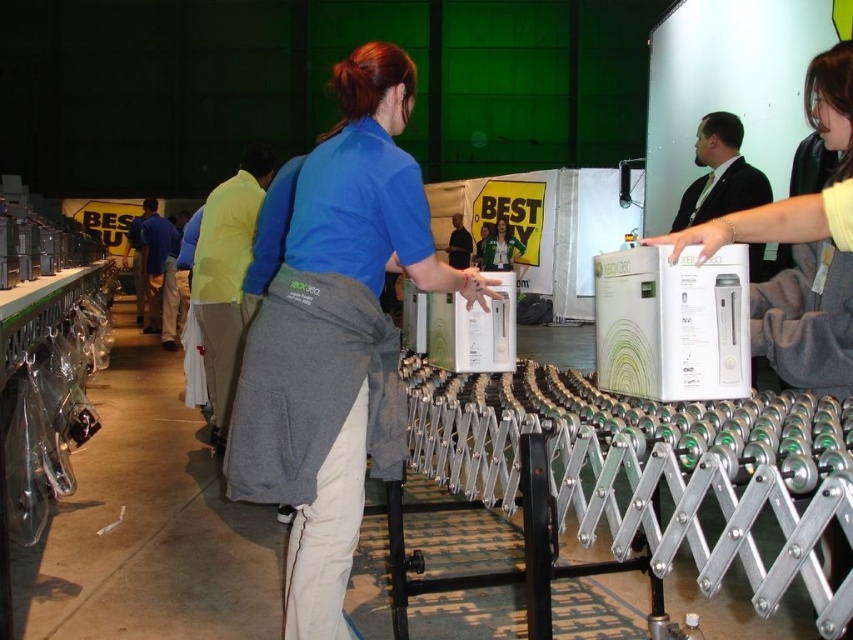
You are an attendee at the event and need to identify the staff member. Which object is closer to the left side of the image? The blue fabric shirt at center or the green fabric jacket at center?

The blue fabric shirt at center is closer to the left side of the image because it is positioned to the left of the green fabric jacket at center.

You are standing at the entrance of the event space and see the blue fabric shirt at center. If you walk straight towards the shirt, will you reach it before the conveyor belt?

The blue fabric shirt at center is located at point (335,337), which is closer to you than the conveyor belt. Therefore, you will reach the blue fabric shirt at center before the conveyor belt.